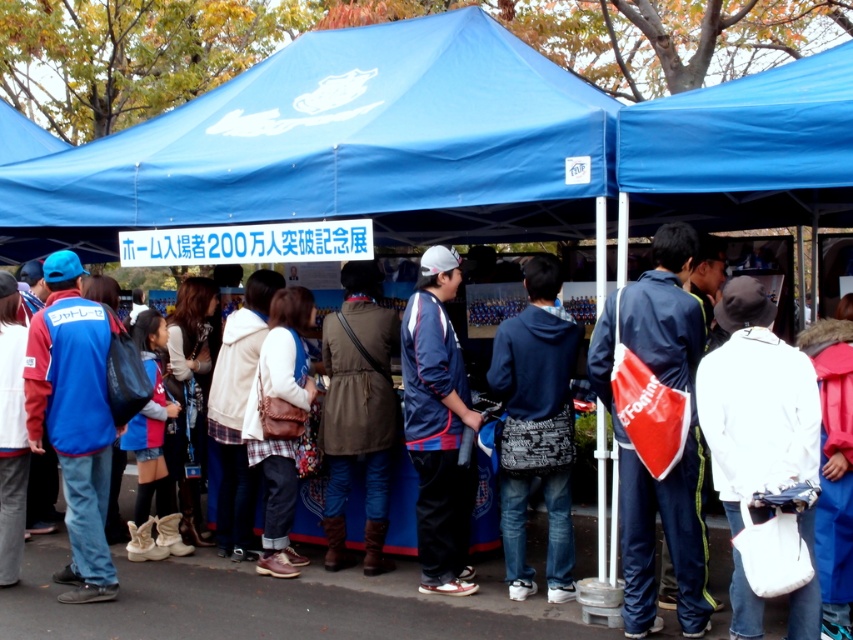
From the picture: You are at the event and need to get to the banner. You see the blue fabric jacket at left and the brown leather jacket at center. Which jacket is closer to you?

The blue fabric jacket at left is closer to you because it is in front of the brown leather jacket at center.

You are a photographer at the event and need to capture a photo of both the blue fabric jacket at left and the brown leather jacket at center. Which jacket should you focus on first to ensure both are in frame without moving the camera?

You should focus on the blue fabric jacket at left first since it is taller than the brown leather jacket at center, ensuring it fits within the camera frame before adjusting for the shorter jacket.